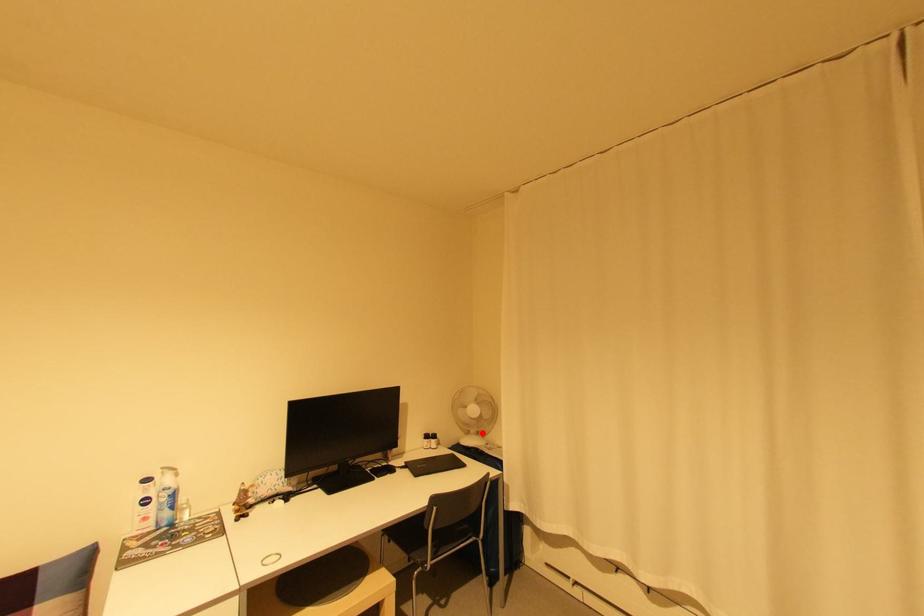
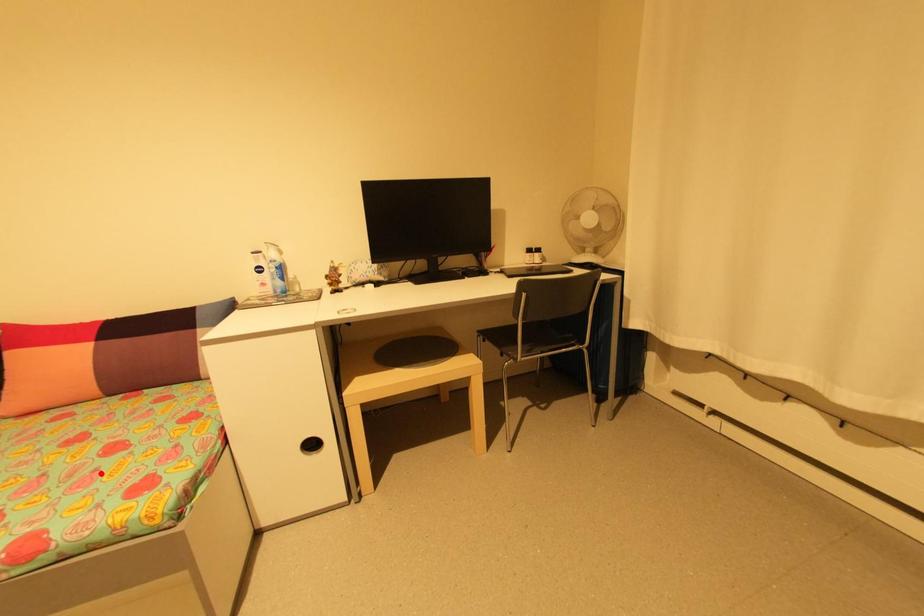
I am providing you with two images of the same scene from different viewpoints. A red point is marked on the first image and another point is marked on the second image. Do the highlighted points in image1 and image2 indicate the same real-world spot?

No